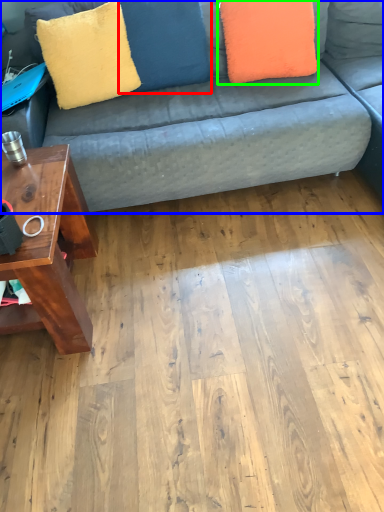
Question: Considering the real-world distances, which object is closest to pillow (highlighted by a red box)? studio couch (highlighted by a blue box) or pillow (highlighted by a green box).

Choices:
 (A) studio couch
 (B) pillow

Answer: (B)